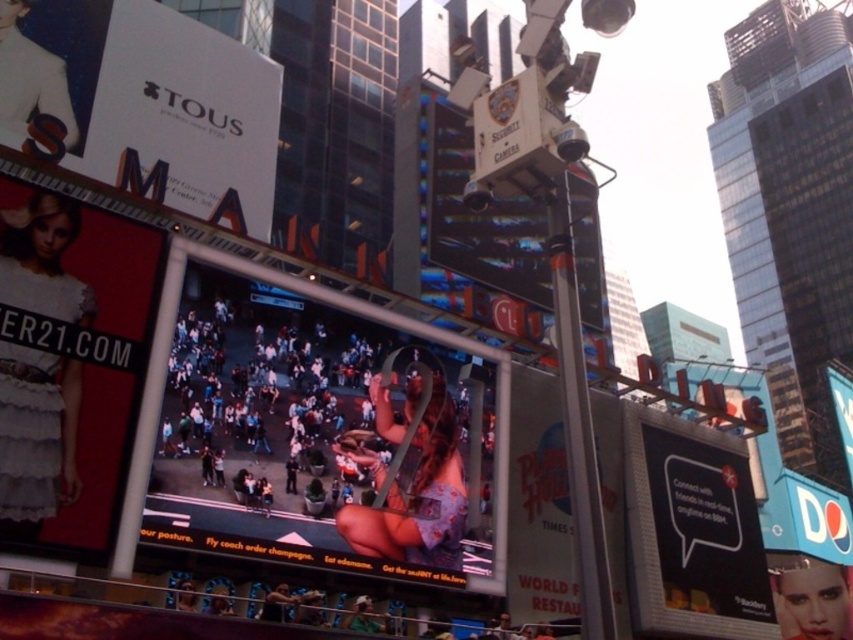
Question: Can you confirm if white glossy sign at upper left is wider than matte pink poster at center?

Choices:
 (A) yes
 (B) no

Answer: (A)

Question: Does black matte billboard at right have a lesser width compared to metallic security camera at upper center?

Choices:
 (A) yes
 (B) no

Answer: (A)

Question: Which point appears closest to the camera in this image?

Choices:
 (A) pos(0,234)
 (B) pos(572,528)
 (C) pos(772,577)

Answer: (A)

Question: Which point is farther to the camera?

Choices:
 (A) matte pink poster at center
 (B) white lace dress at left
 (C) metallic security camera at upper center

Answer: (A)

Question: Is white lace dress at left positioned behind metallic security camera at upper center?

Choices:
 (A) yes
 (B) no

Answer: (B)

Question: Which object appears farthest from the camera in this image?

Choices:
 (A) matte pink poster at center
 (B) matte plastic crowd at center
 (C) white glossy signboard at center

Answer: (A)